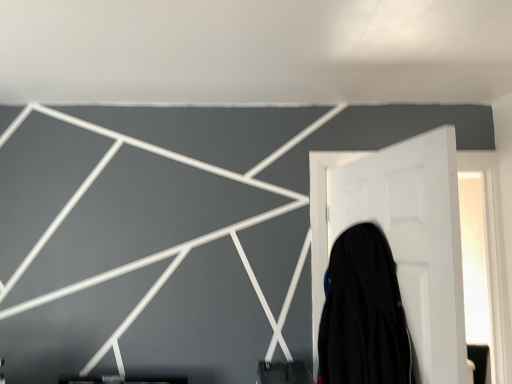
Describe the element at coordinates (362, 313) in the screenshot. I see `black fabric at right` at that location.

Identify the location of black fabric at right. (362, 313).

Measure the distance between point (354,285) and camera.

Point (354,285) is 4.71 feet from camera.

Describe the element at coordinates (403, 239) in the screenshot. The width and height of the screenshot is (512, 384). I see `white matte door at right` at that location.

What is the approximate height of white matte door at right?

86.06 centimeters.

Find the location of a particular element. This screenshot has height=384, width=512. white matte door at right is located at coordinates (403, 239).

This screenshot has width=512, height=384. What are the coordinates of `black fabric at right` in the screenshot? It's located at (362, 313).

Consider the image. Is black fabric at right to the right of white matte door at right from the viewer's perspective?

Incorrect, black fabric at right is not on the right side of white matte door at right.

Is black fabric at right in front of white matte door at right?

No, it is not.

Does point (343, 331) come closer to viewer compared to point (448, 338)?

No, (343, 331) is further to viewer.

From the image's perspective, which object appears higher, black fabric at right or white matte door at right?

white matte door at right.

From a real-world perspective, between black fabric at right and white matte door at right, who is vertically higher?

In real-world perspective, white matte door at right is above.

Considering the sizes of objects black fabric at right and white matte door at right in the image provided, who is thinner, black fabric at right or white matte door at right?

With smaller width is white matte door at right.

From the picture: Does black fabric at right have a lesser height compared to white matte door at right?

Correct, black fabric at right is not as tall as white matte door at right.

Considering the relative sizes of black fabric at right and white matte door at right in the image provided, is black fabric at right bigger than white matte door at right?

No.

From the picture: Is black fabric at right not within white matte door at right?

black fabric at right is positioned outside white matte door at right.

Would you say black fabric at right is a long distance from white matte door at right?

Actually, black fabric at right and white matte door at right are a little close together.

Is black fabric at right turned away from white matte door at right?

Yes, black fabric at right's orientation is away from white matte door at right.

How many degrees apart are the facing directions of black fabric at right and white matte door at right?

There is a 0.151-degree angle between the facing directions of black fabric at right and white matte door at right.

Measure the distance between black fabric at right and white matte door at right.

They are 7.16 inches apart.

What are the coordinates of `garment on the left of white matte door at right` in the screenshot? It's located at pos(362,313).

Considering the positions of objects white matte door at right and black fabric at right in the image provided, who is more to the left, white matte door at right or black fabric at right?

From the viewer's perspective, black fabric at right appears more on the left side.

Who is more distant, white matte door at right or black fabric at right?

black fabric at right is more distant.

Which is in front, point (409, 320) or point (381, 303)?

Point (381, 303)

From the image's perspective, between white matte door at right and black fabric at right, who is located below?

black fabric at right.

From a real-world perspective, relative to black fabric at right, is white matte door at right vertically above or below?

Clearly, from a real-world perspective, white matte door at right is above black fabric at right.

Can you confirm if white matte door at right is thinner than black fabric at right?

Correct, the width of white matte door at right is less than that of black fabric at right.

Which of these two, white matte door at right or black fabric at right, stands shorter?

black fabric at right.

Considering the sizes of objects white matte door at right and black fabric at right in the image provided, who is smaller, white matte door at right or black fabric at right?

black fabric at right.

Can we say white matte door at right lies outside black fabric at right?

white matte door at right lies outside black fabric at right's area.

Would you consider white matte door at right to be distant from black fabric at right?

That's not correct — white matte door at right is a little close to black fabric at right.

Is black fabric at right at the back of white matte door at right?

Correct, white matte door at right is looking away from black fabric at right.

What are the coordinates of `garment located on the left of white matte door at right` in the screenshot? It's located at coord(362,313).

Find the location of `garment behind the white matte door at right`. garment behind the white matte door at right is located at coordinates (362, 313).

In order to click on garment below the white matte door at right (from a real-world perspective) in this screenshot , I will do `click(362, 313)`.